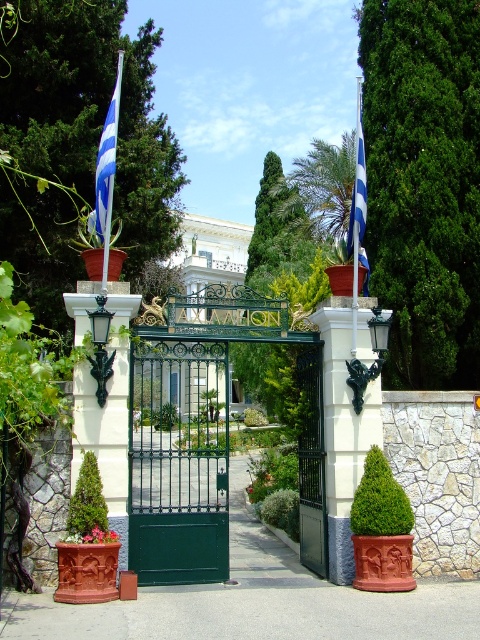
You are a delivery driver approaching the entrance of Axialion. You need to determine if your 2.5 meter tall truck can pass under the green metal gate at center. The green textured bush at center is blocking part of the gate. Can your truck pass under the gate?

The green metal gate at center is above the green textured bush at center, so the bush does not affect the height of the gate. The truck can pass under the gate as long as the gate itself is at least 2.5 meters tall.

You are a delivery person approaching the entrance of Axialion. You see the green metal gate at center and the green textured bush at center. Which object is closer to you as you approach the entrance?

The green metal gate at center is closer to you because the green textured bush at center is behind it.